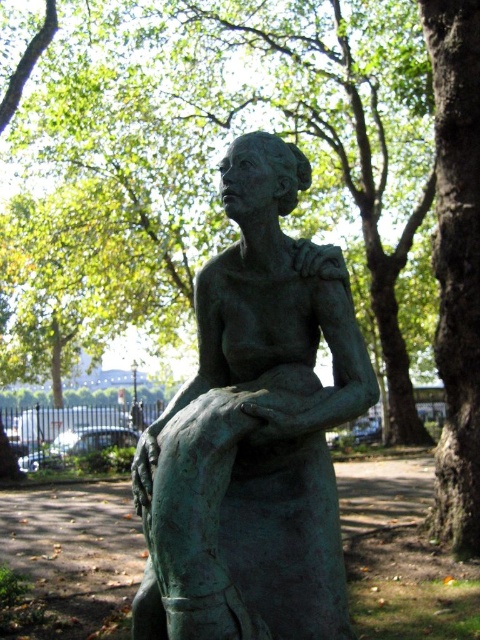
Based on the photo, is green patina tree at center to the right of green patina bronze statue at center from the viewer's perspective?

In fact, green patina tree at center is to the left of green patina bronze statue at center.

Does green patina tree at center have a lesser width compared to green patina bronze statue at center?

In fact, green patina tree at center might be wider than green patina bronze statue at center.

Does point (339, 93) come closer to viewer compared to point (295, 568)?

No, it is not.

Where is `green patina tree at center`? Image resolution: width=480 pixels, height=640 pixels. green patina tree at center is located at coordinates (212, 172).

Can you confirm if green patina bronze statue at center is thinner than green rough bark tree at center right?

Incorrect, green patina bronze statue at center's width is not less than green rough bark tree at center right's.

In the scene shown: Who is more distant from viewer, (241, 147) or (479, 243)?

The point (479, 243) is more distant.

Is point (156, 518) farther from viewer compared to point (442, 225)?

No.

Where is `green patina bronze statue at center`? This screenshot has width=480, height=640. green patina bronze statue at center is located at coordinates click(x=252, y=432).

Who is positioned more to the left, green patina tree at center or green rough bark tree at center right?

From the viewer's perspective, green patina tree at center appears more on the left side.

Can you confirm if green patina tree at center is positioned to the left of green rough bark tree at center right?

Correct, you'll find green patina tree at center to the left of green rough bark tree at center right.

Where is `green patina tree at center`? green patina tree at center is located at coordinates (212, 172).

You are a GUI agent. You are given a task and a screenshot of the screen. Output one action in this format:
    pyautogui.click(x=<x>, y=<y>)
    Task: Click on the green patina tree at center
    The height and width of the screenshot is (640, 480).
    Given the screenshot: What is the action you would take?
    tap(212, 172)